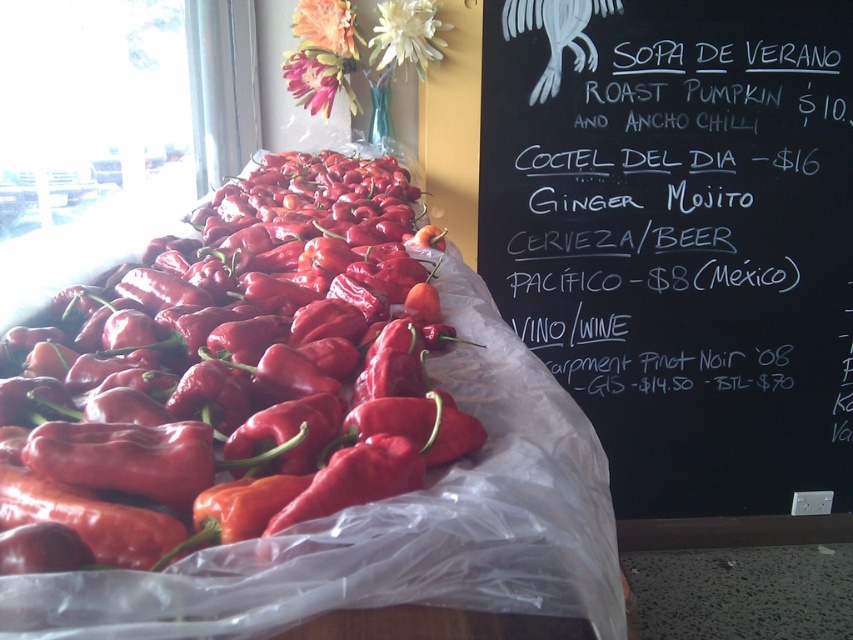
Question: Does black chalkboard at upper right have a greater width compared to white matte flower at upper center?

Choices:
 (A) no
 (B) yes

Answer: (B)

Question: Which object is farther from the camera taking this photo?

Choices:
 (A) black chalkboard at upper right
 (B) matte pink flower at upper center
 (C) shiny red pepper at left
 (D) white matte flower at upper center

Answer: (A)

Question: Which point is closer to the camera taking this photo?

Choices:
 (A) (309, 76)
 (B) (663, 481)
 (C) (325, 1)
 (D) (399, 49)

Answer: (C)

Question: Which point is farther to the camera?

Choices:
 (A) white matte flower at upper center
 (B) pink silk flower at upper center
 (C) matte pink flower at upper center

Answer: (B)

Question: From the image, what is the correct spatial relationship of black chalkboard at upper right in relation to shiny red pepper at left?

Choices:
 (A) above
 (B) below

Answer: (B)

Question: Is shiny red pepper at left to the right of pink silk flower at upper center from the viewer's perspective?

Choices:
 (A) yes
 (B) no

Answer: (A)